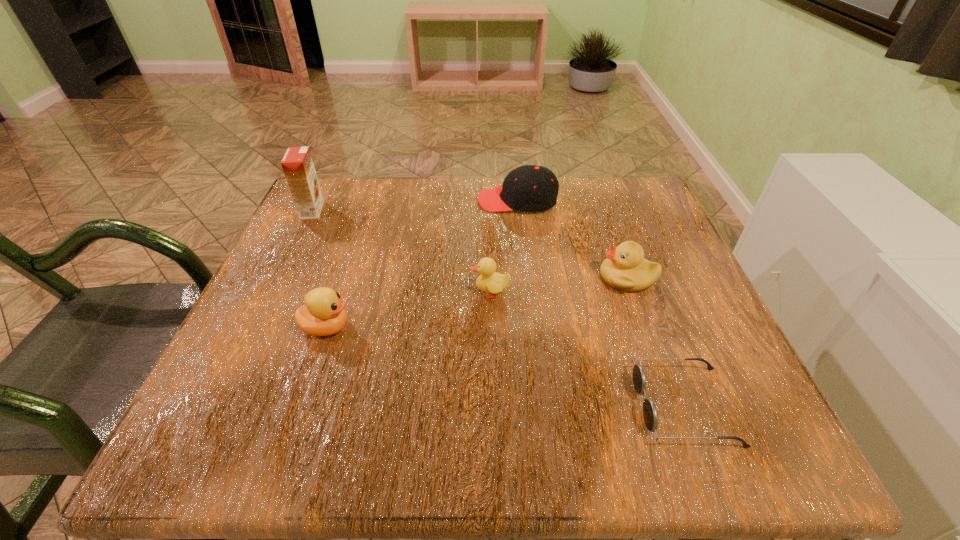
The width and height of the screenshot is (960, 540). I want to click on the leftmost object, so click(x=297, y=164).

Where is `orange juice`? This screenshot has width=960, height=540. orange juice is located at coordinates (297, 164).

The image size is (960, 540). What are the coordinates of `cap` in the screenshot? It's located at (530, 188).

I want to click on the nearest duckling, so click(323, 314).

This screenshot has width=960, height=540. What are the coordinates of `the second nearest object` in the screenshot? It's located at (323, 314).

Where is `the rightmost duckling`? This screenshot has width=960, height=540. the rightmost duckling is located at coordinates (625, 268).

The width and height of the screenshot is (960, 540). What are the coordinates of `the second duckling from left to right` in the screenshot? It's located at (490, 281).

Locate an element on the screen. The width and height of the screenshot is (960, 540). sunglasses is located at coordinates (650, 415).

Locate an element on the screen. The height and width of the screenshot is (540, 960). the shortest object is located at coordinates (650, 415).

Find the location of `free spot located 0.280m on the right of the leftmost object`. free spot located 0.280m on the right of the leftmost object is located at coordinates click(443, 210).